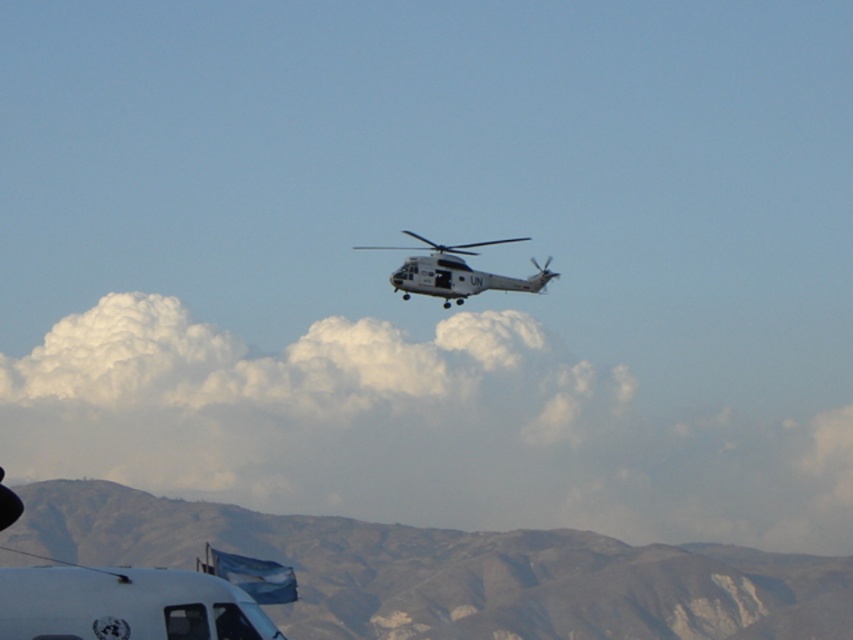
Does gray rocky mountain at lower center have a greater width compared to white matte helicopter at center?

Yes.

Is point (366, 618) more distant than point (434, 266)?

Yes.

Identify the location of gray rocky mountain at lower center. (454, 572).